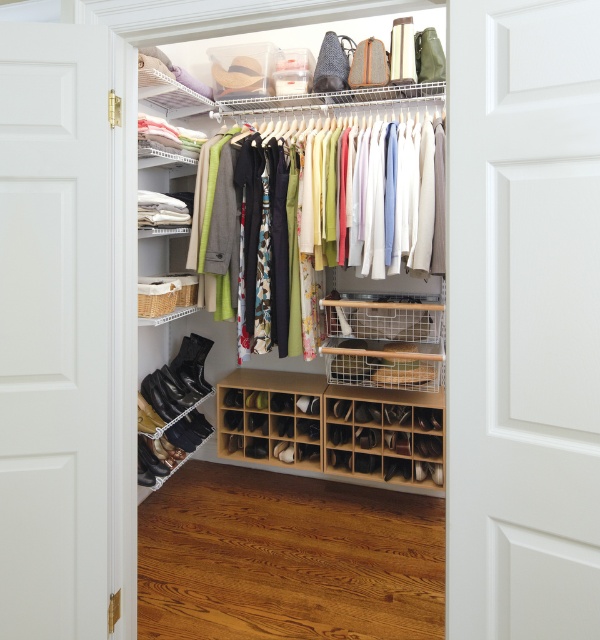
Question: Can you confirm if white painted wood door at center is smaller than wooden shoe organizer at lower center?

Choices:
 (A) no
 (B) yes

Answer: (A)

Question: Among these objects, which one is nearest to the camera?

Choices:
 (A) white wood door at left
 (B) matte white hanger at center

Answer: (A)

Question: Where is wooden shoe organizer at lower center located in relation to matte white hanger at center in the image?

Choices:
 (A) below
 (B) above

Answer: (B)

Question: Is wooden shoe organizer at lower center above matte white hanger at center?

Choices:
 (A) no
 (B) yes

Answer: (B)

Question: Estimate the real-world distances between objects in this image. Which object is farther from the wooden shoe organizer at lower center?

Choices:
 (A) white wood door at left
 (B) matte white hanger at center
 (C) wooden shoe rack at lower center

Answer: (A)

Question: Estimate the real-world distances between objects in this image. Which object is farther from the matte white hanger at center?

Choices:
 (A) white painted wood door at center
 (B) white wood door at left
 (C) wooden shoe organizer at lower center
 (D) wooden shoe rack at lower center

Answer: (A)